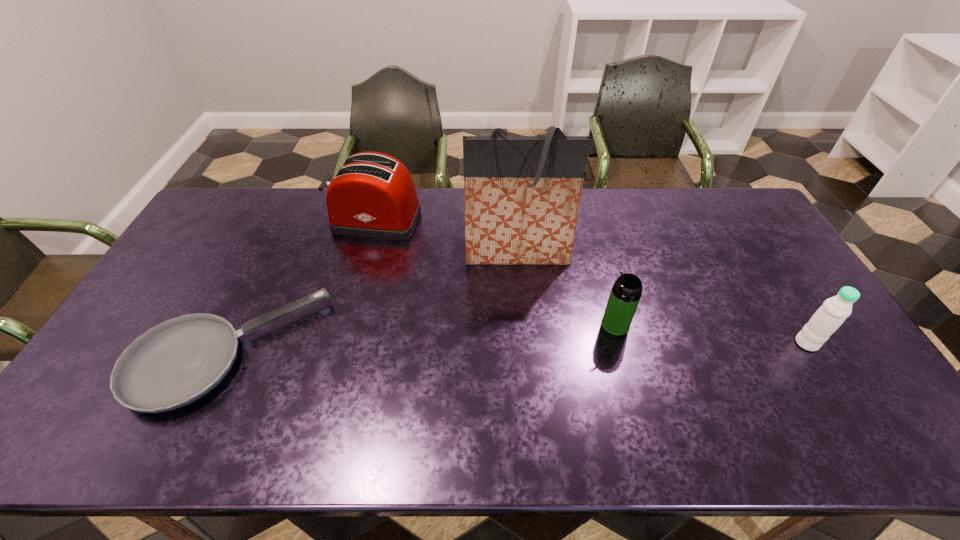
The width and height of the screenshot is (960, 540). Find the location of `vacant space at the left edge`. vacant space at the left edge is located at coordinates (199, 271).

I want to click on vacant space that is in between the toaster and the shopping bag, so click(446, 237).

At what (x,y) coordinates should I click in order to perform the action: click on vacant point located between the shortest object and the tallest object. Please return your answer as a coordinate pair (x, y). Image resolution: width=960 pixels, height=540 pixels. Looking at the image, I should click on (372, 302).

Identify the location of free space that is in between the toaster and the rightmost object. The height and width of the screenshot is (540, 960). (590, 282).

In order to click on free point between the toaster and the rightmost object in this screenshot , I will do `click(590, 282)`.

Locate an element on the screen. free point between the third object from right to left and the water bottle is located at coordinates (662, 298).

Locate an element on the screen. This screenshot has width=960, height=540. unoccupied position between the thermos bottle and the frying pan is located at coordinates (421, 338).

You are a GUI agent. You are given a task and a screenshot of the screen. Output one action in this format:
    pyautogui.click(x=<x>, y=<y>)
    Task: Click on the free space between the toaster and the rightmost object
    
    Given the screenshot: What is the action you would take?
    pyautogui.click(x=590, y=282)

At what (x,y) coordinates should I click in order to perform the action: click on vacant space that is in between the shortest object and the rightmost object. Please return your answer as a coordinate pair (x, y). The height and width of the screenshot is (540, 960). Looking at the image, I should click on (516, 347).

Identify the location of vacant area between the thermos bottle and the toaster. Image resolution: width=960 pixels, height=540 pixels. (495, 273).